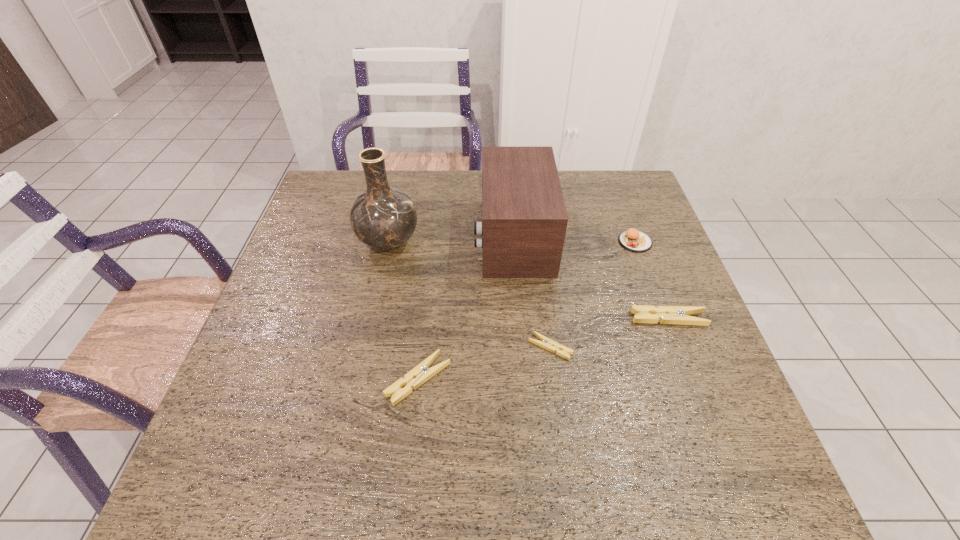
At what (x,y) coordinates should I click in order to perform the action: click on vacant space located 0.050m on the left of the second clothespin from left to right. Please return your answer as a coordinate pair (x, y). Looking at the image, I should click on (507, 347).

The image size is (960, 540). In order to click on blank space located 0.240m on the left of the farthest clothespin in this screenshot , I will do `click(531, 319)`.

The image size is (960, 540). What are the coordinates of `vacant space located 0.370m on the front-facing side of the second tallest object` in the screenshot? It's located at (345, 237).

Locate an element on the screen. free spot located 0.320m on the front-facing side of the second tallest object is located at coordinates (363, 237).

What are the coordinates of `vacant area located on the front-facing side of the second tallest object` in the screenshot? It's located at (408, 237).

Image resolution: width=960 pixels, height=540 pixels. I want to click on blank area located on the right of the vase, so click(x=467, y=242).

Where is `vacant space situated on the back of the fourth shortest object`? The height and width of the screenshot is (540, 960). vacant space situated on the back of the fourth shortest object is located at coordinates (625, 214).

This screenshot has width=960, height=540. I want to click on object positioned at the far edge, so click(524, 220).

Where is `object that is positioned at the near edge`? object that is positioned at the near edge is located at coordinates (421, 373).

Image resolution: width=960 pixels, height=540 pixels. I want to click on clothespin that is at the right edge, so click(678, 315).